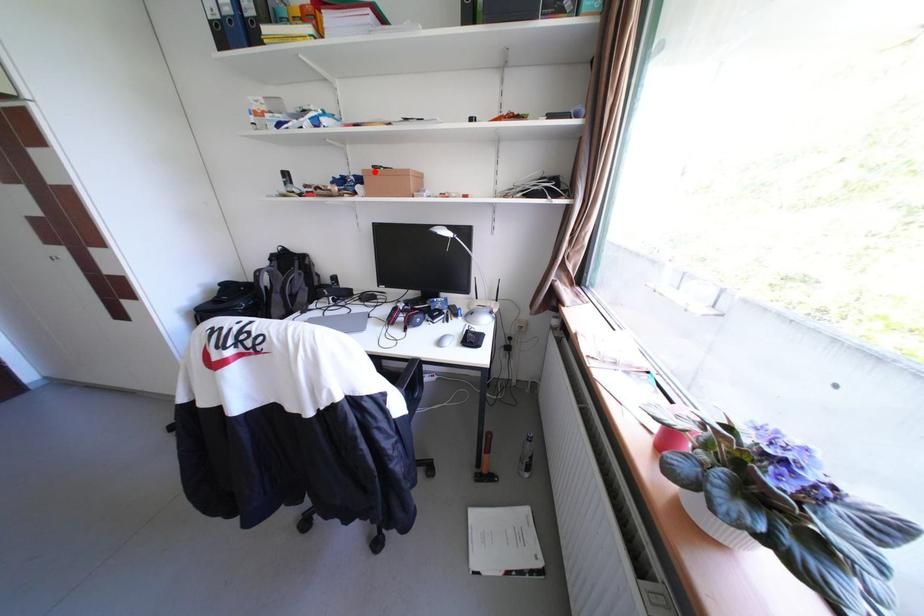
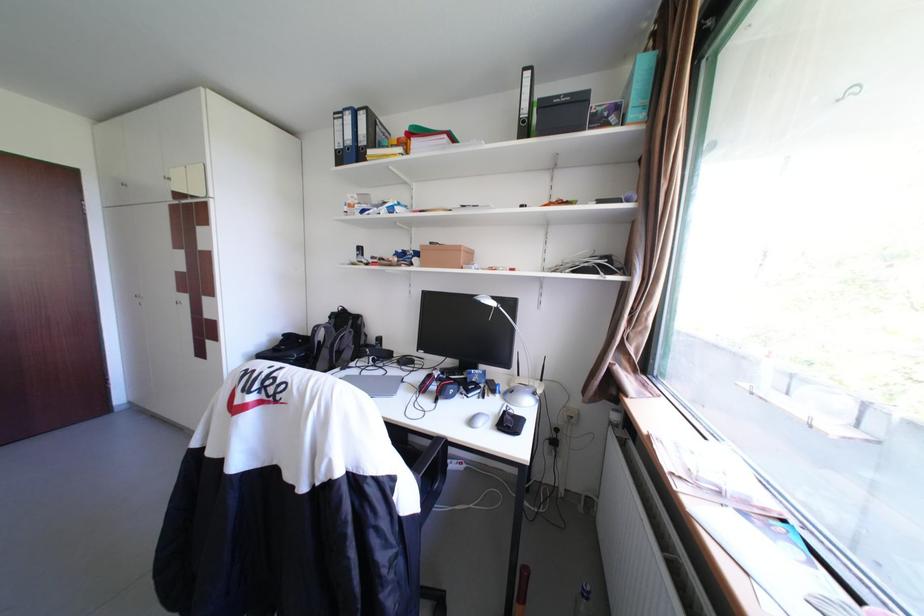
Find the pixel in the second image that matches the highlighted location in the first image.

(432, 246)